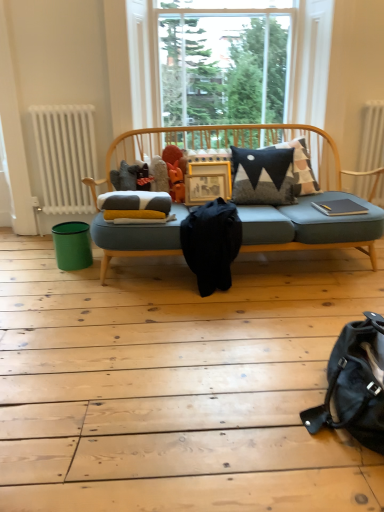
Question: In terms of height, does white textured radiator at upper right, the second radiator viewed from the left, look taller or shorter compared to wooden frame at center?

Choices:
 (A) short
 (B) tall

Answer: (B)

Question: From a real-world perspective, is white textured radiator at upper right, which ranks as the first radiator in right-to-left order, above or below wooden frame at center?

Choices:
 (A) below
 (B) above

Answer: (B)

Question: Based on their relative distances, which object is farther from the white radiator at left, the first radiator in the left-to-right sequence?

Choices:
 (A) black leather messenger bag at lower right, arranged as the 1th messenger bag when viewed from the front
 (B) white textured radiator at upper right, which ranks as the first radiator in right-to-left order
 (C) hardcover book at right
 (D) black fabric messenger bag at center, the second messenger bag from the bottom
 (E) orange matte figurine at center

Answer: (A)

Question: Based on their relative distances, which object is farther from the clear glass window at center?

Choices:
 (A) wooden frame at center
 (B) teal plastic bin at lower left
 (C) hardcover book at right
 (D) black leather messenger bag at lower right, marked as the second messenger bag in a top-to-bottom arrangement
 (E) soft woolen blanket at center

Answer: (D)